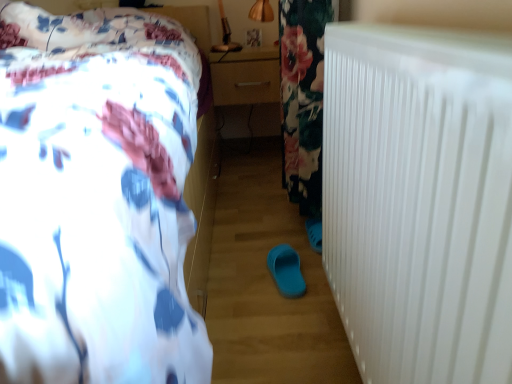
Describe the element at coordinates (245, 82) in the screenshot. The image size is (512, 384). I see `matte wood drawer at center` at that location.

At what (x,y) coordinates should I click in order to perform the action: click on white floral bedspread at upper left. Please return your answer as a coordinate pair (x, y). The height and width of the screenshot is (384, 512). Looking at the image, I should click on (97, 198).

Measure the distance between white plastic radiator at right and camera.

The distance of white plastic radiator at right from camera is 11.06 inches.

This screenshot has width=512, height=384. I want to click on matte wood drawer at center, so click(x=245, y=82).

Does white plastic radiator at right have a greater width compared to white floral bedspread at upper left?

In fact, white plastic radiator at right might be narrower than white floral bedspread at upper left.

Is white plastic radiator at right bigger than white floral bedspread at upper left?

Actually, white plastic radiator at right might be smaller than white floral bedspread at upper left.

Is white plastic radiator at right outside of white floral bedspread at upper left?

white plastic radiator at right lies outside white floral bedspread at upper left's area.

From a real-world perspective, between white plastic radiator at right and white floral bedspread at upper left, who is vertically higher?

white floral bedspread at upper left is physically above.

Is white floral bedspread at upper left facing away from blue rubber slipper at center?

white floral bedspread at upper left does not have its back to blue rubber slipper at center.

Considering the relative positions of white floral bedspread at upper left and blue rubber slipper at center in the image provided, is white floral bedspread at upper left to the left or to the right of blue rubber slipper at center?

Clearly, white floral bedspread at upper left is on the left of blue rubber slipper at center in the image.

Which is further, (136,303) or (290,247)?

Positioned behind is point (290,247).

Can you tell me how much white plastic radiator at right and blue rubber slipper at center differ in facing direction?

The facing directions of white plastic radiator at right and blue rubber slipper at center are 7.31 degrees apart.

Considering the positions of objects white plastic radiator at right and blue rubber slipper at center in the image provided, who is more to the left, white plastic radiator at right or blue rubber slipper at center?

Positioned to the left is blue rubber slipper at center.

Who is shorter, white plastic radiator at right or blue rubber slipper at center?

blue rubber slipper at center.

Looking at this image, considering the sizes of objects blue rubber slipper at center and white floral bedspread at upper left in the image provided, who is bigger, blue rubber slipper at center or white floral bedspread at upper left?

white floral bedspread at upper left is bigger.

What's the angular difference between blue rubber slipper at center and white floral bedspread at upper left's facing directions?

82.8 degrees separate the facing orientations of blue rubber slipper at center and white floral bedspread at upper left.

From a real-world perspective, is blue rubber slipper at center positioned above or below white floral bedspread at upper left?

blue rubber slipper at center is below white floral bedspread at upper left.

Based on the photo, is blue rubber slipper at center inside the boundaries of white floral bedspread at upper left, or outside?

blue rubber slipper at center lies outside white floral bedspread at upper left.

Is white plastic radiator at right at the back of matte wood drawer at center?

matte wood drawer at center is not turned away from white plastic radiator at right.

Would you say matte wood drawer at center is inside or outside white plastic radiator at right?

The correct answer is: outside.

Would you say matte wood drawer at center is a long distance from white plastic radiator at right?

That's right, there is a large distance between matte wood drawer at center and white plastic radiator at right.

From a real-world perspective, who is located lower, matte wood drawer at center or white plastic radiator at right?

From a 3D spatial view, white plastic radiator at right is below.

Relative to blue rubber slipper at center, is matte wood drawer at center in front or behind?

Clearly, matte wood drawer at center is behind blue rubber slipper at center.

The height and width of the screenshot is (384, 512). I want to click on footwear below the matte wood drawer at center (from the image's perspective), so click(x=286, y=271).

Considering the positions of objects blue rubber slipper at center and matte wood drawer at center in the image provided, who is behind, blue rubber slipper at center or matte wood drawer at center?

matte wood drawer at center.

Is blue rubber slipper at center located outside matte wood drawer at center?

Yes, blue rubber slipper at center is not within matte wood drawer at center.

Which is behind, point (272, 274) or point (216, 100)?

Point (216, 100)

You are a GUI agent. You are given a task and a screenshot of the screen. Output one action in this format:
    pyautogui.click(x=<x>, y=<y>)
    Task: Click on the footwear that appears below the matte wood drawer at center (from the image's perspective)
    This screenshot has height=384, width=512.
    Given the screenshot: What is the action you would take?
    pyautogui.click(x=286, y=271)

Locate an element on the screen. The height and width of the screenshot is (384, 512). bed in front of the white plastic radiator at right is located at coordinates (97, 198).

Where is `bed above the blue rubber slipper at center (from the image's perspective)`? This screenshot has width=512, height=384. bed above the blue rubber slipper at center (from the image's perspective) is located at coordinates (97, 198).

Looking at the image, which one is located closer to white floral bedspread at upper left, matte wood drawer at center or blue rubber slipper at center?

blue rubber slipper at center.

When comparing their distances from white plastic radiator at right, does white floral bedspread at upper left or matte wood drawer at center seem further?

Based on the image, matte wood drawer at center appears to be further to white plastic radiator at right.

From the image, which object appears to be farther from blue rubber slipper at center, matte wood drawer at center or white floral bedspread at upper left?

The object further to blue rubber slipper at center is matte wood drawer at center.

From the image, which object appears to be nearer to blue rubber slipper at center, white floral bedspread at upper left or white plastic radiator at right?

white plastic radiator at right lies closer to blue rubber slipper at center than the other object.

Considering their positions, is blue rubber slipper at center positioned further to matte wood drawer at center than white floral bedspread at upper left?

blue rubber slipper at center is positioned further to the anchor matte wood drawer at center.

Estimate the real-world distances between objects in this image. Which object is further from white plastic radiator at right, matte wood drawer at center or white floral bedspread at upper left?

matte wood drawer at center.

Looking at the image, which one is located further to matte wood drawer at center, blue rubber slipper at center or white plastic radiator at right?

white plastic radiator at right is further to matte wood drawer at center.

Which object lies further to the anchor point blue rubber slipper at center, matte wood drawer at center or white plastic radiator at right?

matte wood drawer at center is positioned further to the anchor blue rubber slipper at center.

I want to click on radiator located between white floral bedspread at upper left and blue rubber slipper at center in the depth direction, so click(420, 201).

The width and height of the screenshot is (512, 384). What are the coordinates of `footwear between white floral bedspread at upper left and matte wood drawer at center in the front-back direction` in the screenshot? It's located at (286, 271).

Identify the location of radiator located between white floral bedspread at upper left and matte wood drawer at center in the depth direction. (420, 201).

Where is `footwear between white plastic radiator at right and matte wood drawer at center along the z-axis`? The image size is (512, 384). footwear between white plastic radiator at right and matte wood drawer at center along the z-axis is located at coordinates (286, 271).